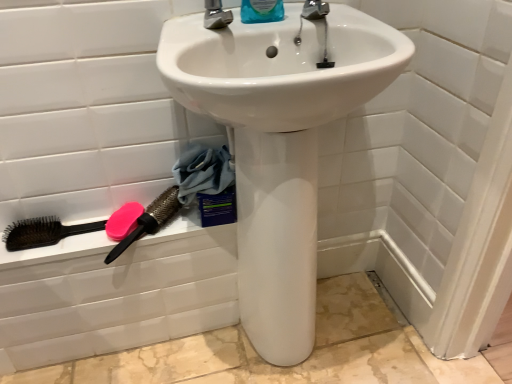
Find the location of `vacant area that lies to the right of white glossy sink at center`. vacant area that lies to the right of white glossy sink at center is located at coordinates (383, 326).